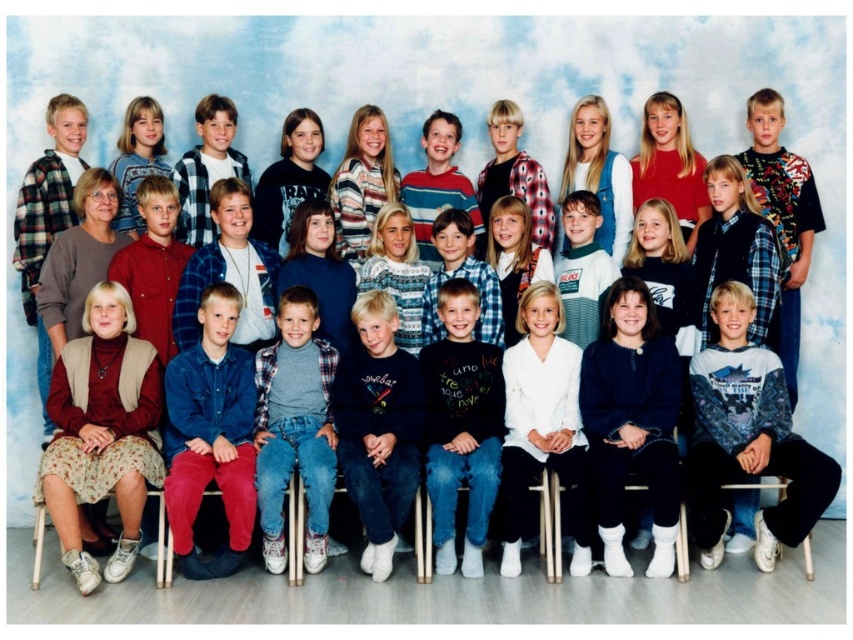
Consider the image. Which is above, white cotton shirt at center or matte red shirt at upper right?

Positioned higher is matte red shirt at upper right.

Can you confirm if white cotton shirt at center is wider than matte red shirt at upper right?

Correct, the width of white cotton shirt at center exceeds that of matte red shirt at upper right.

Is point (819, 470) positioned after point (683, 184)?

No, it is in front of (683, 184).

Where is `white cotton shirt at center`? This screenshot has height=640, width=853. white cotton shirt at center is located at coordinates (747, 438).

Who is more forward, (480, 561) or (685, 148)?

Point (480, 561)

Is dark blue jeans at center closer to camera compared to matte red shirt at upper right?

Yes, dark blue jeans at center is in front of matte red shirt at upper right.

The image size is (853, 640). What do you see at coordinates (461, 426) in the screenshot?
I see `dark blue jeans at center` at bounding box center [461, 426].

Identify the location of dark blue jeans at center. Image resolution: width=853 pixels, height=640 pixels. (461, 426).

Can you confirm if white cotton shirt at center is shorter than white fleece sweater at upper center?

No.

Image resolution: width=853 pixels, height=640 pixels. What do you see at coordinates (747, 438) in the screenshot?
I see `white cotton shirt at center` at bounding box center [747, 438].

Describe the element at coordinates (747, 438) in the screenshot. The width and height of the screenshot is (853, 640). I see `white cotton shirt at center` at that location.

Where is `white cotton shirt at center`? white cotton shirt at center is located at coordinates (747, 438).